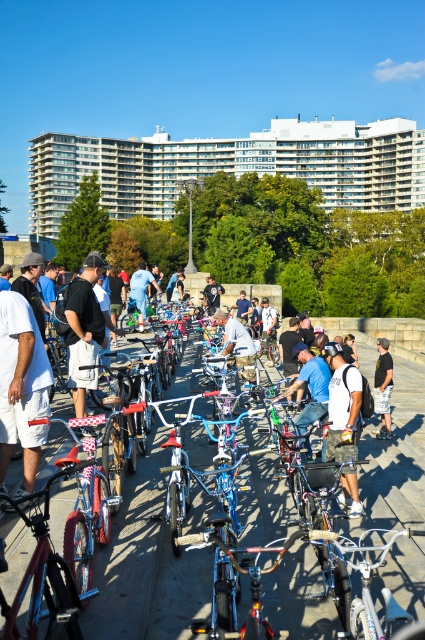
Question: Among these objects, which one is farthest from the camera?

Choices:
 (A) denim shorts at center
 (B) dark blue jeans at center
 (C) white cotton t-shirt at center
 (D) blue metallic bicycle at center

Answer: (B)

Question: In this image, where is concrete pavement at center located relative to light brown shorts at center?

Choices:
 (A) left
 (B) right

Answer: (A)

Question: Is concrete pavement at center below matte black shirt at center?

Choices:
 (A) yes
 (B) no

Answer: (A)

Question: Observing the image, what is the correct spatial positioning of matte black shirt at center in reference to blue metallic bicycle at center?

Choices:
 (A) left
 (B) right

Answer: (A)

Question: Which object is closer to the camera taking this photo?

Choices:
 (A) concrete pavement at center
 (B) light brown shorts at center

Answer: (A)

Question: Estimate the real-world distances between objects in this image. Which object is closer to the metallic silver bicycle at center?

Choices:
 (A) white cotton t-shirt at center
 (B) dark blue jeans at center
 (C) concrete pavement at center

Answer: (C)